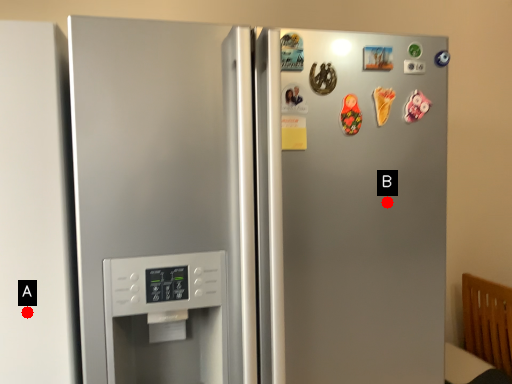
Question: Two points are circled on the image, labeled by A and B beside each circle. Which of the following is the farthest from the observer?

Choices:
 (A) A is further
 (B) B is further

Answer: (B)